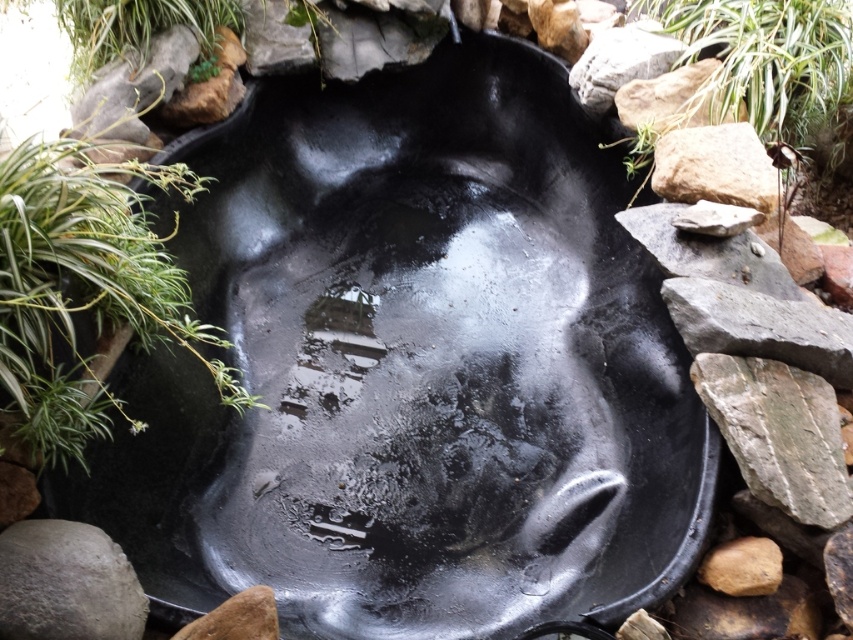
Can you confirm if gray rough stone at right is taller than smooth gray rock at upper right?

Yes, gray rough stone at right is taller than smooth gray rock at upper right.

Does gray rough stone at right come in front of smooth gray rock at upper right?

That is True.

Which is in front, point (792, 396) or point (709, 125)?

Point (792, 396)

The width and height of the screenshot is (853, 640). I want to click on gray rough stone at right, so click(x=779, y=433).

In the scene shown: Does green leafy plant at center have a smaller size compared to gray rough stone at lower left?

No.

Is point (3, 202) closer to camera compared to point (83, 541)?

No, (3, 202) is further to viewer.

The height and width of the screenshot is (640, 853). I want to click on green leafy plant at center, so (x=85, y=292).

From the picture: Can you confirm if green leafy plant at upper right is positioned to the right of gray rough stone at lower left?

Correct, you'll find green leafy plant at upper right to the right of gray rough stone at lower left.

Does point (730, 4) lie in front of point (68, 600)?

No, (730, 4) is behind (68, 600).

At what (x,y) coordinates should I click in order to perform the action: click on green leafy plant at upper right. Please return your answer as a coordinate pair (x, y). Looking at the image, I should click on 769,54.